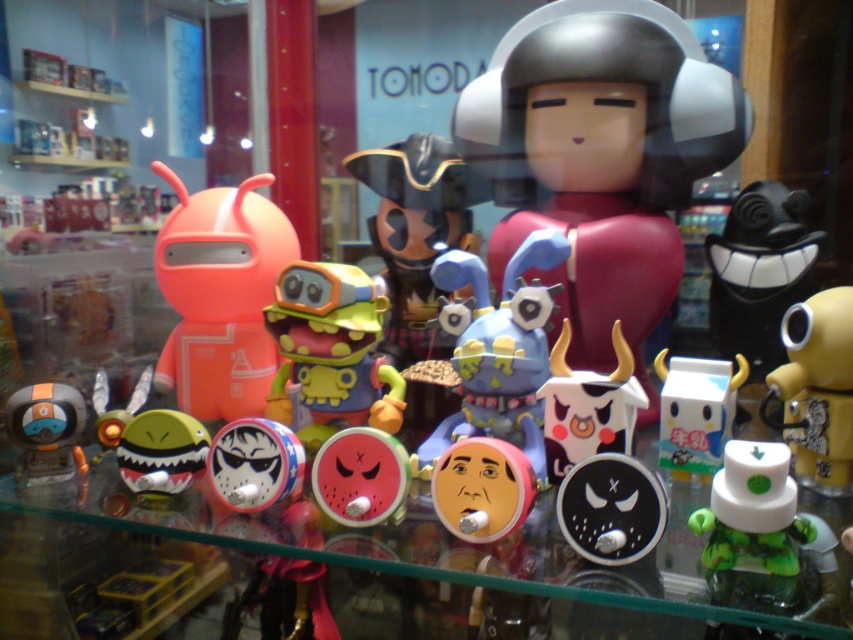
Question: Can you confirm if yellow matte toy at right is smaller than white matte cow at center?

Choices:
 (A) no
 (B) yes

Answer: (B)

Question: Is yellow matte toy at right to the left of shiny metallic shark at center from the viewer's perspective?

Choices:
 (A) yes
 (B) no

Answer: (B)

Question: Estimate the real-world distances between objects in this image. Which object is farther from the white matte milk carton at center?

Choices:
 (A) matte silver helmet at center
 (B) watermelon matte toy at center
 (C) transparent glass shelf at center

Answer: (C)

Question: Which of the following is the closest to the observer?

Choices:
 (A) (20, 472)
 (B) (358, 374)
 (C) (200, 278)
 (D) (161, 428)

Answer: (D)

Question: Which point is farther to the camera?

Choices:
 (A) watermelon matte toy at center
 (B) pink matte face at center

Answer: (A)

Question: Can you confirm if matte yellow toy at center is positioned to the left of watermelon matte toy at center?

Choices:
 (A) yes
 (B) no

Answer: (A)